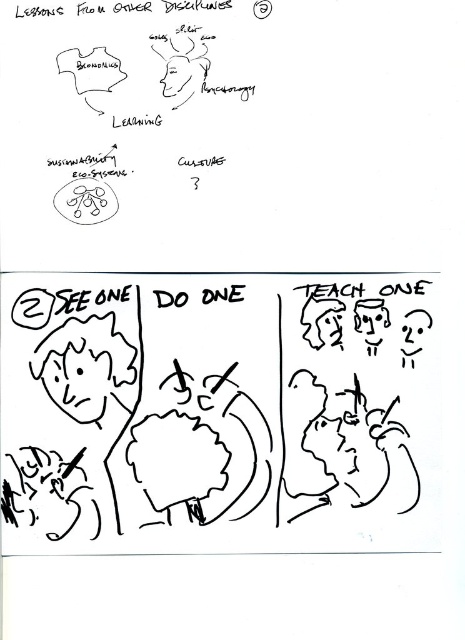
Which is more to the right, black ink pen at lower left or smooth skin face at center?

Positioned to the right is smooth skin face at center.

Who is more forward, (x=418, y=410) or (x=386, y=483)?

Point (x=386, y=483) is more forward.

This screenshot has height=640, width=465. What are the coordinates of `black ink pen at lower left` in the screenshot? It's located at (219, 412).